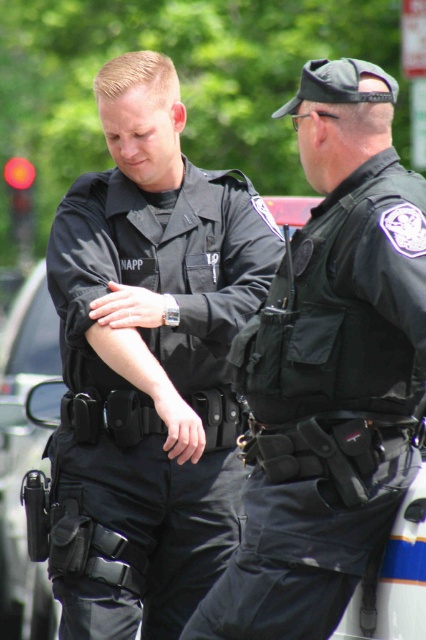
Question: Which point is closer to the camera?

Choices:
 (A) black tactical vest at center
 (B) black matte uniform at center

Answer: (A)

Question: Among these points, which one is nearest to the camera?

Choices:
 (A) (383, 184)
 (B) (103, 280)

Answer: (A)

Question: Which point is farther to the camera?

Choices:
 (A) black matte uniform at center
 (B) black tactical vest at center

Answer: (A)

Question: Can you confirm if black matte uniform at center is bigger than black tactical vest at center?

Choices:
 (A) yes
 (B) no

Answer: (A)

Question: Does black matte uniform at center lie behind black tactical vest at center?

Choices:
 (A) yes
 (B) no

Answer: (A)

Question: Does black matte uniform at center have a larger size compared to black tactical vest at center?

Choices:
 (A) no
 (B) yes

Answer: (B)